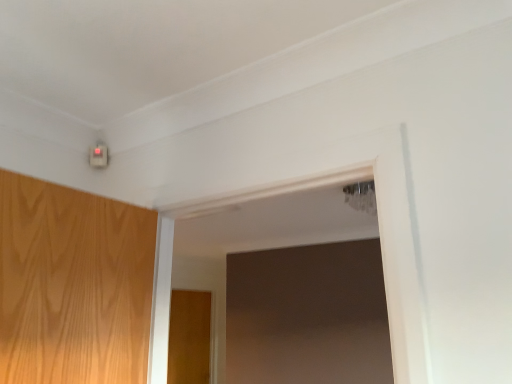
Measure the distance between point (x=202, y=365) and camera.

A distance of 17.40 feet exists between point (x=202, y=365) and camera.

The height and width of the screenshot is (384, 512). Identify the location of matte wood screen door at center. (189, 337).

Describe the element at coordinates (189, 337) in the screenshot. I see `matte wood screen door at center` at that location.

Locate an element on the screen. This screenshot has width=512, height=384. matte wood screen door at center is located at coordinates (189, 337).